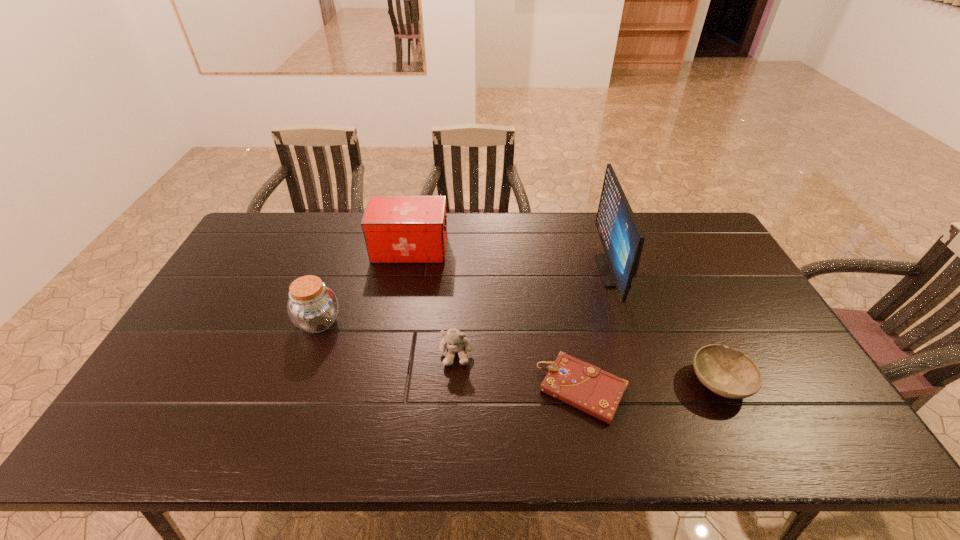
The width and height of the screenshot is (960, 540). Identify the location of computer monitor. (621, 236).

You are a GUI agent. You are given a task and a screenshot of the screen. Output one action in this format:
    pyautogui.click(x=<x>, y=<y>)
    Task: Click on the second object from right to left
    
    Given the screenshot: What is the action you would take?
    pyautogui.click(x=621, y=236)

This screenshot has width=960, height=540. I want to click on the first-aid kit, so click(397, 229).

Find the location of a particular element. Image resolution: width=960 pixels, height=540 pixels. the leftmost object is located at coordinates (312, 307).

What are the coordinates of `the fourth object from right to left` in the screenshot? It's located at (456, 342).

Locate an element on the screen. teddy bear is located at coordinates (456, 342).

Image resolution: width=960 pixels, height=540 pixels. In order to click on the rightmost object in this screenshot , I will do [730, 373].

I want to click on the second shortest object, so click(730, 373).

The height and width of the screenshot is (540, 960). I want to click on the fourth object from left to right, so click(582, 385).

Find the location of a particular element. This screenshot has height=540, width=960. notebook is located at coordinates (582, 385).